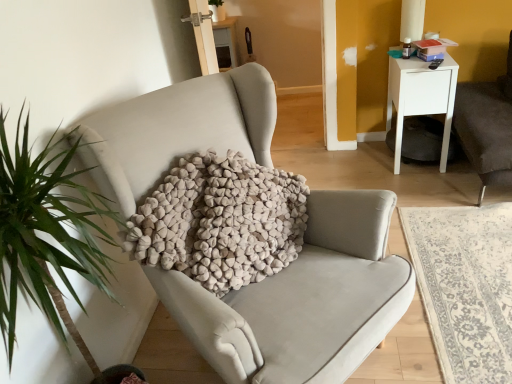
Find the location of a particular element. This screenshot has width=512, height=384. vacant area that lies in front of white glossy nightstand at upper right is located at coordinates point(436,185).